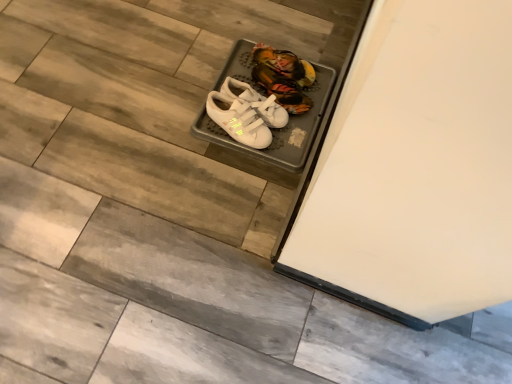
Describe the element at coordinates (239, 120) in the screenshot. I see `white velcro sneakers at center, which appears as the third footwear when viewed from the back` at that location.

Locate an element on the screen. The image size is (512, 384). white velcro sneakers at center, which is the first footwear in back-to-front order is located at coordinates (281, 69).

Measure the distance between white matte sneakers at center, positioned as the 2th footwear in front-to-back order, and camera.

white matte sneakers at center, positioned as the 2th footwear in front-to-back order, and camera are 4.15 feet apart.

In order to click on white velcro sneakers at center, positioned as the 1th footwear in front-to-back order in this screenshot , I will do `click(239, 120)`.

From the image's perspective, who appears lower, white matte sneakers at center, positioned as the 2th footwear in front-to-back order, or white velcro sneakers at center, which is the first footwear in back-to-front order?

white matte sneakers at center, positioned as the 2th footwear in front-to-back order, is shown below in the image.

Is white velcro sneakers at center, the 3th footwear when ordered from front to back, at the back of white matte sneakers at center, positioned as the 2th footwear in front-to-back order?

white matte sneakers at center, positioned as the 2th footwear in front-to-back order, is not turned away from white velcro sneakers at center, the 3th footwear when ordered from front to back.

Are white matte sneakers at center, which is the 2th footwear in back-to-front order, and white velcro sneakers at center, the 3th footwear when ordered from front to back, located far from each other?

No.

From their relative heights in the image, would you say white matte sneakers at center, which is the 2th footwear in back-to-front order, is taller or shorter than white velcro sneakers at center, which is the first footwear in back-to-front order?

Considering their sizes, white matte sneakers at center, which is the 2th footwear in back-to-front order, has more height than white velcro sneakers at center, which is the first footwear in back-to-front order.

Looking at this image, which of these two, white velcro sneakers at center, which is the first footwear in back-to-front order, or white matte sneakers at center, which is the 2th footwear in back-to-front order, is smaller?

white velcro sneakers at center, which is the first footwear in back-to-front order, is smaller.

Is white velcro sneakers at center, which is the first footwear in back-to-front order, not near white matte sneakers at center, which is the 2th footwear in back-to-front order?

white velcro sneakers at center, which is the first footwear in back-to-front order, is near white matte sneakers at center, which is the 2th footwear in back-to-front order, not far away.

Consider the image. Considering the positions of objects white velcro sneakers at center, which is the first footwear in back-to-front order, and white matte sneakers at center, which is the 2th footwear in back-to-front order, in the image provided, who is more to the right, white velcro sneakers at center, which is the first footwear in back-to-front order, or white matte sneakers at center, which is the 2th footwear in back-to-front order,?

white velcro sneakers at center, which is the first footwear in back-to-front order, is more to the right.

Consider the image. Is white velcro sneakers at center, positioned as the 1th footwear in front-to-back order, positioned beyond the bounds of white velcro sneakers at center, the 3th footwear when ordered from front to back?

Yes, white velcro sneakers at center, positioned as the 1th footwear in front-to-back order, is outside of white velcro sneakers at center, the 3th footwear when ordered from front to back.

Locate an element on the screen. This screenshot has height=384, width=512. the 2nd footwear to the right of the white velcro sneakers at center, positioned as the 1th footwear in front-to-back order, counting from the anchor's position is located at coordinates (281, 69).

Is point (270, 133) more distant than point (259, 54)?

No, it is in front of (259, 54).

Is white velcro sneakers at center, which appears as the third footwear when viewed from the back, looking in the opposite direction of white velcro sneakers at center, the 3th footwear when ordered from front to back?

white velcro sneakers at center, which appears as the third footwear when viewed from the back, is not turned away from white velcro sneakers at center, the 3th footwear when ordered from front to back.

Is white matte sneakers at center, which is the 2th footwear in back-to-front order, oriented away from white velcro sneakers at center, positioned as the 1th footwear in front-to-back order?

That's not correct — white matte sneakers at center, which is the 2th footwear in back-to-front order, is not looking away from white velcro sneakers at center, positioned as the 1th footwear in front-to-back order.

Looking at this image, from a real-world perspective, who is located higher, white matte sneakers at center, which is the 2th footwear in back-to-front order, or white velcro sneakers at center, positioned as the 1th footwear in front-to-back order?

white matte sneakers at center, which is the 2th footwear in back-to-front order, from a real-world perspective.

Are white matte sneakers at center, positioned as the 2th footwear in front-to-back order, and white velcro sneakers at center, positioned as the 1th footwear in front-to-back order, beside each other?

Yes.

Considering the sizes of white matte sneakers at center, positioned as the 2th footwear in front-to-back order, and white velcro sneakers at center, which appears as the third footwear when viewed from the back, in the image, is white matte sneakers at center, positioned as the 2th footwear in front-to-back order, bigger or smaller than white velcro sneakers at center, which appears as the third footwear when viewed from the back,?

Clearly, white matte sneakers at center, positioned as the 2th footwear in front-to-back order, is larger in size than white velcro sneakers at center, which appears as the third footwear when viewed from the back.

From the image's perspective, which footwear is the 1st one above the white velcro sneakers at center, which appears as the third footwear when viewed from the back? Please provide its 2D coordinates.

[(256, 102)]

Is white velcro sneakers at center, positioned as the 1th footwear in front-to-back order, oriented away from white matte sneakers at center, which is the 2th footwear in back-to-front order?

No, white velcro sneakers at center, positioned as the 1th footwear in front-to-back order,'s orientation is not away from white matte sneakers at center, which is the 2th footwear in back-to-front order.

Between point (211, 100) and point (220, 93), which one is positioned behind?

The point (220, 93) is behind.

Is white velcro sneakers at center, which is the first footwear in back-to-front order, beside white velcro sneakers at center, positioned as the 1th footwear in front-to-back order?

There is a gap between white velcro sneakers at center, which is the first footwear in back-to-front order, and white velcro sneakers at center, positioned as the 1th footwear in front-to-back order.

Considering the positions of points (266, 73) and (249, 139), is point (266, 73) farther from camera compared to point (249, 139)?

Yes, it is behind point (249, 139).

Does white velcro sneakers at center, the 3th footwear when ordered from front to back, appear on the left side of white velcro sneakers at center, which appears as the third footwear when viewed from the back?

In fact, white velcro sneakers at center, the 3th footwear when ordered from front to back, is to the right of white velcro sneakers at center, which appears as the third footwear when viewed from the back.

Locate an element on the screen. This screenshot has height=384, width=512. the 2nd footwear positioned above the white velcro sneakers at center, the 3th footwear when ordered from front to back (from a real-world perspective) is located at coordinates (256, 102).

There is a white matte sneakers at center, which is the 2th footwear in back-to-front order. Identify the location of the 2nd footwear below it (from a real-world perspective). This screenshot has height=384, width=512. tap(281, 69).

Which object lies further to the anchor point white velcro sneakers at center, positioned as the 1th footwear in front-to-back order, white velcro sneakers at center, which is the first footwear in back-to-front order, or white matte sneakers at center, which is the 2th footwear in back-to-front order?

white velcro sneakers at center, which is the first footwear in back-to-front order, lies further to white velcro sneakers at center, positioned as the 1th footwear in front-to-back order, than the other object.

From the image, which object appears to be nearer to white matte sneakers at center, positioned as the 2th footwear in front-to-back order, white velcro sneakers at center, the 3th footwear when ordered from front to back, or white velcro sneakers at center, positioned as the 1th footwear in front-to-back order?

white velcro sneakers at center, positioned as the 1th footwear in front-to-back order, lies closer to white matte sneakers at center, positioned as the 2th footwear in front-to-back order, than the other object.

Based on their spatial positions, is white matte sneakers at center, positioned as the 2th footwear in front-to-back order, or white velcro sneakers at center, which is the first footwear in back-to-front order, further from white velcro sneakers at center, positioned as the 1th footwear in front-to-back order?

white velcro sneakers at center, which is the first footwear in back-to-front order, is positioned further to the anchor white velcro sneakers at center, positioned as the 1th footwear in front-to-back order.

Looking at this image, from the image, which object appears to be farther from white velcro sneakers at center, which is the first footwear in back-to-front order, white velcro sneakers at center, positioned as the 1th footwear in front-to-back order, or white matte sneakers at center, positioned as the 2th footwear in front-to-back order?

white velcro sneakers at center, positioned as the 1th footwear in front-to-back order, is positioned further to the anchor white velcro sneakers at center, which is the first footwear in back-to-front order.

From the image, which object appears to be farther from white velcro sneakers at center, which is the first footwear in back-to-front order, white matte sneakers at center, positioned as the 2th footwear in front-to-back order, or white velcro sneakers at center, positioned as the 1th footwear in front-to-back order?

white velcro sneakers at center, positioned as the 1th footwear in front-to-back order.

Estimate the real-world distances between objects in this image. Which object is further from white matte sneakers at center, positioned as the 2th footwear in front-to-back order, white velcro sneakers at center, positioned as the 1th footwear in front-to-back order, or white velcro sneakers at center, which is the first footwear in back-to-front order?

white velcro sneakers at center, which is the first footwear in back-to-front order, lies further to white matte sneakers at center, positioned as the 2th footwear in front-to-back order, than the other object.

Locate an element on the screen. footwear between white velcro sneakers at center, the 3th footwear when ordered from front to back, and white velcro sneakers at center, which appears as the third footwear when viewed from the back, in the vertical direction is located at coordinates (256, 102).